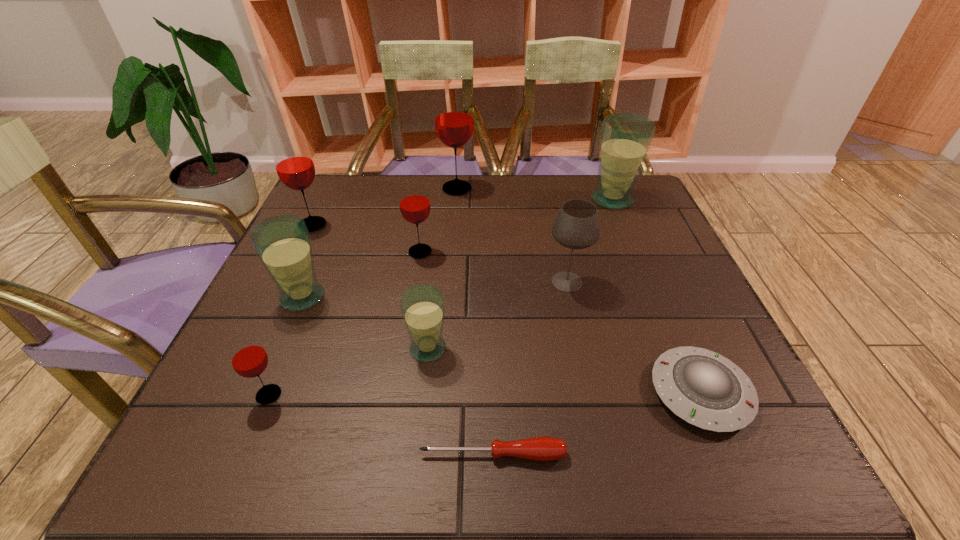
You are a GUI agent. You are given a task and a screenshot of the screen. Output one action in this format:
    pyautogui.click(x=<x>, y=<y>)
    Task: Click on the free space at the far left corner of the desktop
    
    Given the screenshot: What is the action you would take?
    pyautogui.click(x=318, y=185)

Image resolution: width=960 pixels, height=540 pixels. Find the location of `vacant point located between the third object from right to left and the third farthest glass`. vacant point located between the third object from right to left and the third farthest glass is located at coordinates (440, 253).

At what (x,y) coordinates should I click in order to perform the action: click on unoccupied area between the saucer and the nearest object. Please return your answer as a coordinate pair (x, y). Looking at the image, I should click on (596, 423).

Locate an element on the screen. vacant space in between the red screwdriver and the second farthest blue glass is located at coordinates (397, 376).

Locate an element on the screen. free space between the ninth tallest object and the nearest red glass is located at coordinates (485, 394).

The image size is (960, 540). Identify the location of free spot between the wineglass and the biggest red glass. (512, 235).

The width and height of the screenshot is (960, 540). Identify the location of free spot between the eighth object from left to right and the saucer. (634, 337).

The width and height of the screenshot is (960, 540). Find the location of `free spot between the fourth farthest object and the third farthest object`. free spot between the fourth farthest object and the third farthest object is located at coordinates (367, 238).

The height and width of the screenshot is (540, 960). I want to click on free spot between the seventh nearest object and the leftmost blue glass, so click(x=361, y=274).

Locate an element on the screen. This screenshot has width=960, height=540. unoccupied area between the second shortest object and the second blue glass from left to right is located at coordinates (564, 370).